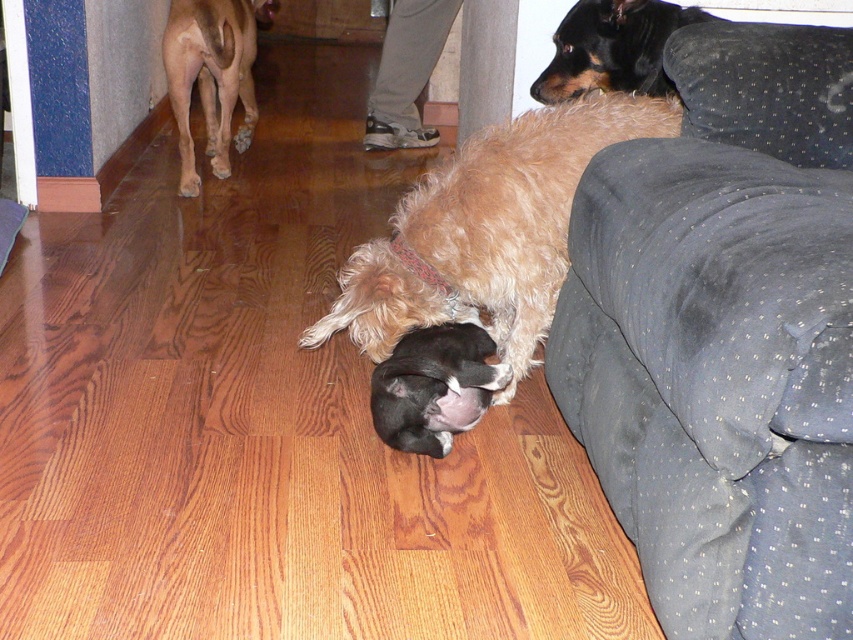
You are standing in the room and see the point marked at coordinate (486, 230). Which object is this point located on?

The point marked at coordinate (486, 230) is located on the fuzzy brown dog at center.

Please determine the coordinates of the black fur at center in the image. The coordinates should be in the format of a point with two decimal places, such as point [434,387].

The coordinates of the black fur at center are point [434,387].

What are the coordinates of the fuzzy brown dog at center?

The fuzzy brown dog at center is located at point (486, 230).